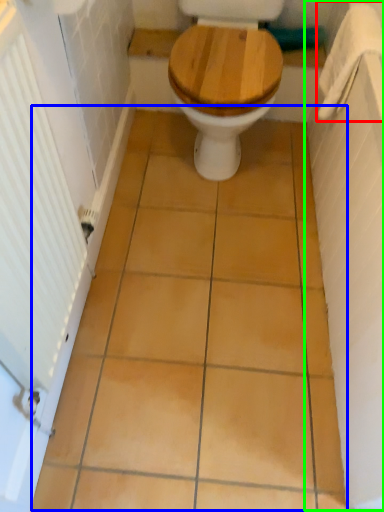
Question: Which object is positioned closest to towel bar (highlighted by a red box)? Select from ceramic tile (highlighted by a blue box) and bath (highlighted by a green box).

Choices:
 (A) ceramic tile
 (B) bath

Answer: (B)